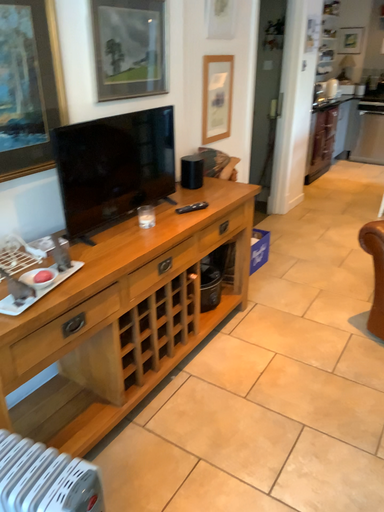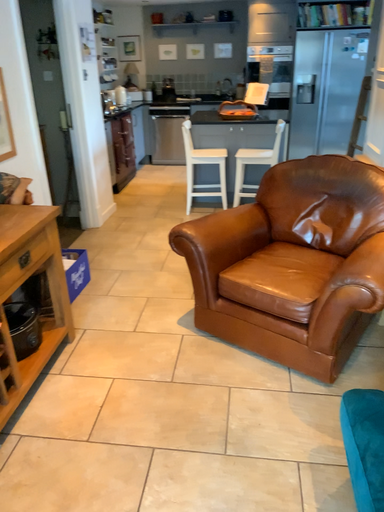
Question: How did the camera likely rotate when shooting the video?

Choices:
 (A) rotated left
 (B) rotated right

Answer: (B)